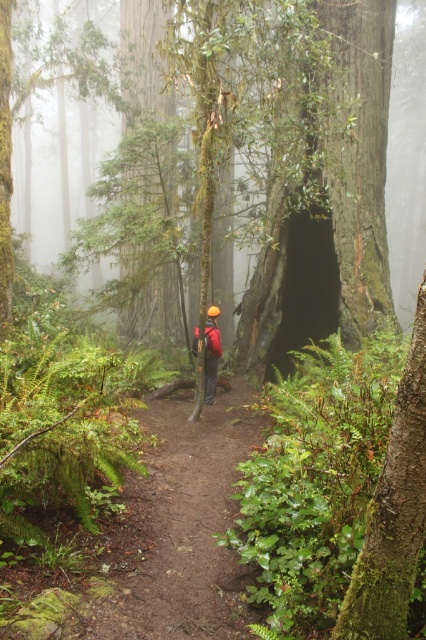
You are a hiker carrying the red fabric backpack at center and want to walk along the brown dirt path at center. Can your backpack fit through the narrowest part of the path?

The brown dirt path at center is wider than the red fabric backpack at center, so the backpack can fit through the narrowest part of the path.